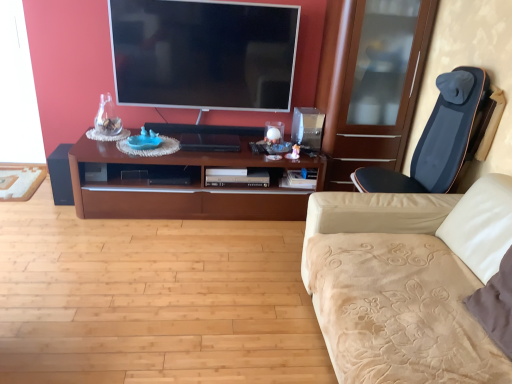
You are a GUI agent. You are given a task and a screenshot of the screen. Output one action in this format:
    pyautogui.click(x=<x>, y=<y>)
    Task: Click on the free space on the front side of brown wood cabinet at center
    The image size is (512, 384).
    Given the screenshot: What is the action you would take?
    pyautogui.click(x=166, y=278)